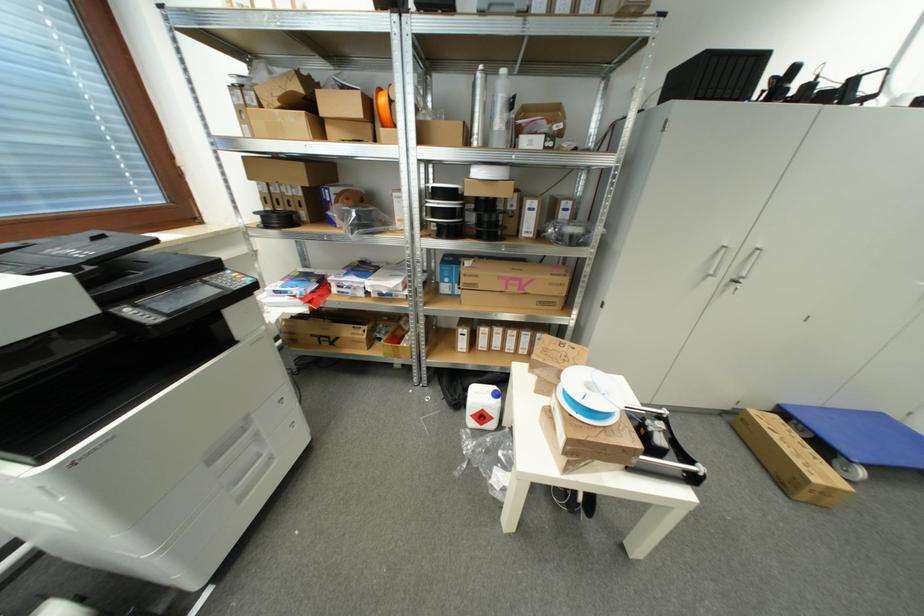
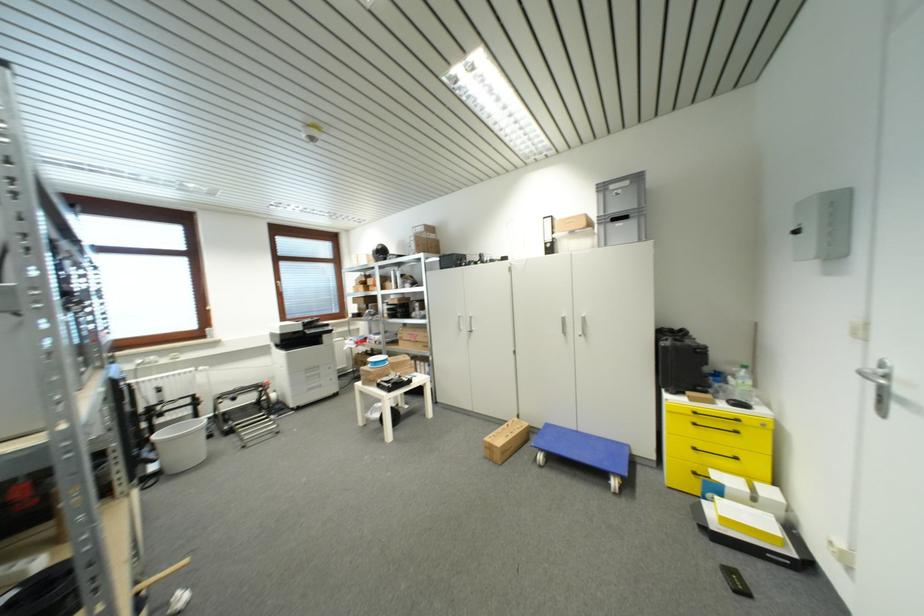
The point at (125,240) is marked in the first image. Where is the corresponding point in the second image?

(320, 321)